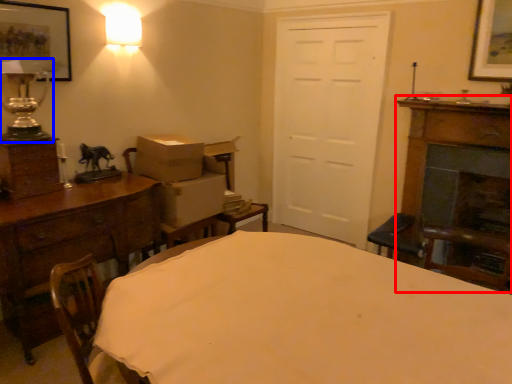
Question: Which object is further to the camera taking this photo, fireplace (highlighted by a red box) or table lamp (highlighted by a blue box)?

Choices:
 (A) fireplace
 (B) table lamp

Answer: (A)